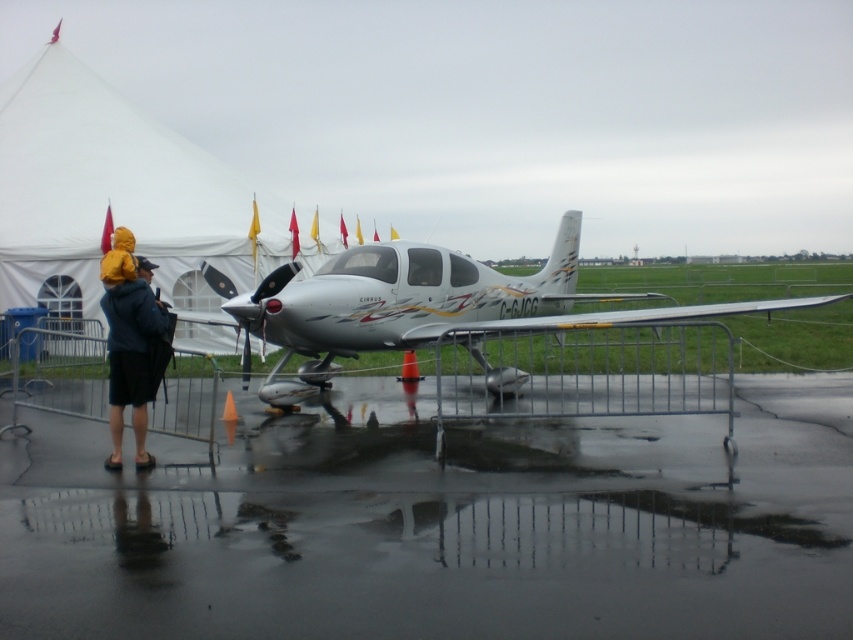
Question: Can you confirm if glossy asphalt tarmac at center is bigger than silver metallic airplane at center?

Choices:
 (A) no
 (B) yes

Answer: (A)

Question: Among these points, which one is nearest to the camera?

Choices:
 (A) (572, 256)
 (B) (123, 403)

Answer: (B)

Question: Which point is farther to the camera?

Choices:
 (A) (201, 211)
 (B) (119, 396)
 (C) (347, 428)
 (D) (276, 310)

Answer: (A)

Question: Can you confirm if glossy asphalt tarmac at center is positioned above white fabric tent at upper left?

Choices:
 (A) no
 (B) yes

Answer: (A)

Question: Is glossy asphalt tarmac at center above white fabric tent at upper left?

Choices:
 (A) yes
 (B) no

Answer: (B)

Question: Considering the real-world distances, which object is farthest from the silver metallic airplane at center?

Choices:
 (A) glossy asphalt tarmac at center
 (B) white fabric tent at upper left
 (C) yellow waterproof jacket at left

Answer: (A)